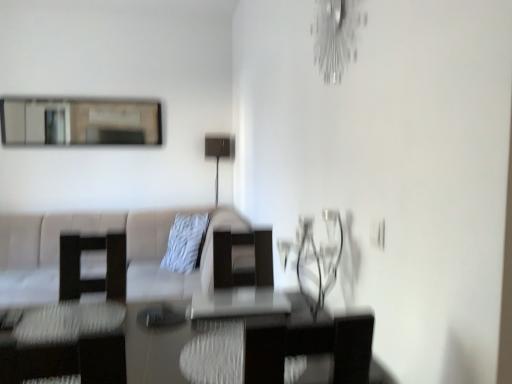
The width and height of the screenshot is (512, 384). What are the coordinates of `matte black lamp at center` in the screenshot? It's located at (218, 153).

Image resolution: width=512 pixels, height=384 pixels. I want to click on polished glass table at center, so click(x=89, y=345).

This screenshot has height=384, width=512. Describe the element at coordinates (72, 322) in the screenshot. I see `matte black swivel chair at left` at that location.

Describe the element at coordinates (238, 303) in the screenshot. I see `transparent glass table at center` at that location.

The height and width of the screenshot is (384, 512). I want to click on matte glass mirror at upper left, so click(80, 122).

Looking at this image, could you tell me if white textured pillow at center is facing matte black swivel chair at left?

No, white textured pillow at center is not oriented towards matte black swivel chair at left.

Is white textured pillow at center far from matte black swivel chair at left?

Absolutely, white textured pillow at center is distant from matte black swivel chair at left.

Looking at this image, can you confirm if white textured pillow at center is taller than matte black swivel chair at left?

No.

From the image's perspective, does white textured pillow at center appear lower than matte black swivel chair at left?

Yes.

Could you tell me if white textured pillow at center is facing matte glass mirror at upper left?

No, white textured pillow at center does not turn towards matte glass mirror at upper left.

Would you say white textured pillow at center is a long distance from matte glass mirror at upper left?

That's right, there is a large distance between white textured pillow at center and matte glass mirror at upper left.

Considering the sizes of white textured pillow at center and matte glass mirror at upper left in the image, is white textured pillow at center taller or shorter than matte glass mirror at upper left?

white textured pillow at center is shorter than matte glass mirror at upper left.

Based on their sizes in the image, would you say white textured pillow at center is bigger or smaller than matte glass mirror at upper left?

Considering their sizes, white textured pillow at center takes up more space than matte glass mirror at upper left.

Does matte black lamp at center have a lesser height compared to transparent glass table at center?

No, matte black lamp at center is not shorter than transparent glass table at center.

Does matte black lamp at center have a smaller size compared to transparent glass table at center?

Actually, matte black lamp at center might be larger than transparent glass table at center.

Are matte black lamp at center and transparent glass table at center far apart?

matte black lamp at center is positioned a significant distance from transparent glass table at center.

From a real-world perspective, who is located lower, matte black lamp at center or transparent glass table at center?

From a 3D spatial view, transparent glass table at center is below.

Which is more to the left, matte black swivel chair at left or polished glass table at center?

matte black swivel chair at left is more to the left.

Based on the photo, which object is further away from the camera, matte black swivel chair at left or polished glass table at center?

Positioned behind is matte black swivel chair at left.

Which object is further away from the camera, matte black swivel chair at left or white textured pillow at center?

white textured pillow at center.

Which of these two, matte black swivel chair at left or white textured pillow at center, stands shorter?

white textured pillow at center.

Is matte black swivel chair at left surrounding white textured pillow at center?

That's incorrect, white textured pillow at center is not inside matte black swivel chair at left.

Does matte black swivel chair at left touch white textured pillow at center?

No, matte black swivel chair at left is not beside white textured pillow at center.

Consider the image. From a real-world perspective, which is physically above, metallic silver light fixture at upper right or matte black lamp at center?

In real-world perspective, metallic silver light fixture at upper right is above.

Locate an element on the screen. The width and height of the screenshot is (512, 384). light fixture above the matte black lamp at center (from the image's perspective) is located at coordinates (336, 36).

Looking at the image, does metallic silver light fixture at upper right seem bigger or smaller compared to matte black lamp at center?

metallic silver light fixture at upper right is smaller than matte black lamp at center.

Who is taller, metallic silver light fixture at upper right or matte black lamp at center?

matte black lamp at center is taller.

Could you tell me if metallic silver light fixture at upper right is turned towards matte black swivel chair at left?

No, metallic silver light fixture at upper right is not facing towards matte black swivel chair at left.

Considering the sizes of objects metallic silver light fixture at upper right and matte black swivel chair at left in the image provided, who is bigger, metallic silver light fixture at upper right or matte black swivel chair at left?

Bigger between the two is matte black swivel chair at left.

Does point (326, 28) lie behind point (36, 312)?

No, (326, 28) is in front of (36, 312).

Where is `pillow below the matte black swivel chair at left (from the image's perspective)`? The width and height of the screenshot is (512, 384). pillow below the matte black swivel chair at left (from the image's perspective) is located at coordinates (185, 242).

At what (x,y) coordinates should I click in order to perform the action: click on mirror located behind the white textured pillow at center. Please return your answer as a coordinate pair (x, y). This screenshot has height=384, width=512. Looking at the image, I should click on (80, 122).

From the image, which object appears to be nearer to matte glass mirror at upper left, matte black swivel chair at left or transparent glass table at center?

matte black swivel chair at left is closer to matte glass mirror at upper left.

Considering their positions, is matte black swivel chair at left positioned further to white textured pillow at center than matte glass mirror at upper left?

matte black swivel chair at left lies further to white textured pillow at center than the other object.

Which object lies further to the anchor point matte glass mirror at upper left, matte black swivel chair at left or white textured pillow at center?

Based on the image, matte black swivel chair at left appears to be further to matte glass mirror at upper left.

From the image, which object appears to be farther from matte black lamp at center, transparent glass table at center or white textured pillow at center?

transparent glass table at center is positioned further to the anchor matte black lamp at center.

Considering their positions, is white textured pillow at center positioned closer to matte black lamp at center than transparent glass table at center?

white textured pillow at center.

From the image, which object appears to be nearer to matte black lamp at center, transparent glass table at center or matte black swivel chair at left?

matte black swivel chair at left lies closer to matte black lamp at center than the other object.

Which object lies nearer to the anchor point matte black swivel chair at left, matte glass mirror at upper left or polished glass table at center?

polished glass table at center is closer to matte black swivel chair at left.

Based on their spatial positions, is matte black lamp at center or metallic silver light fixture at upper right closer to matte glass mirror at upper left?

matte black lamp at center lies closer to matte glass mirror at upper left than the other object.

Image resolution: width=512 pixels, height=384 pixels. What are the coordinates of `light fixture between polished glass table at center and white textured pillow at center from front to back` in the screenshot? It's located at (336, 36).

You are a GUI agent. You are given a task and a screenshot of the screen. Output one action in this format:
    pyautogui.click(x=<x>, y=<y>)
    Task: Click on the glass table between metallic silver light fixture at upper right and polished glass table at center in the up-down direction
    The image size is (512, 384).
    Given the screenshot: What is the action you would take?
    pyautogui.click(x=238, y=303)

You are a GUI agent. You are given a task and a screenshot of the screen. Output one action in this format:
    pyautogui.click(x=<x>, y=<y>)
    Task: Click on the swivel chair between metallic silver light fixture at upper right and matte glass mirror at upper left along the z-axis
    The width and height of the screenshot is (512, 384).
    Given the screenshot: What is the action you would take?
    pyautogui.click(x=72, y=322)

The width and height of the screenshot is (512, 384). Find the location of `swivel chair located between polished glass table at center and transparent glass table at center in the depth direction`. swivel chair located between polished glass table at center and transparent glass table at center in the depth direction is located at coordinates (72, 322).